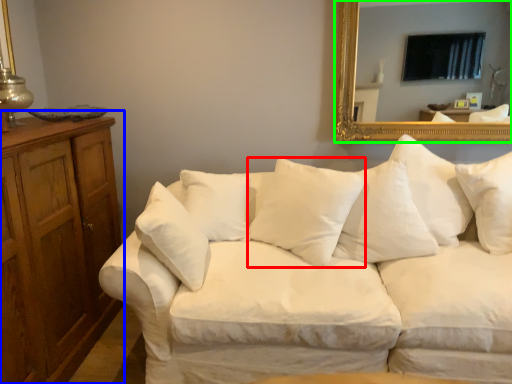
Question: Which object is positioned farthest from pillow (highlighted by a red box)? Select from dresser (highlighted by a blue box) and mirror (highlighted by a green box).

Choices:
 (A) dresser
 (B) mirror

Answer: (A)